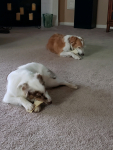
The image size is (113, 150). Find the location of `brown wooden furniture`. brown wooden furniture is located at coordinates (109, 16).